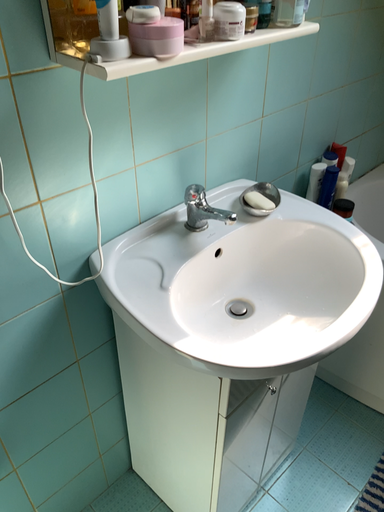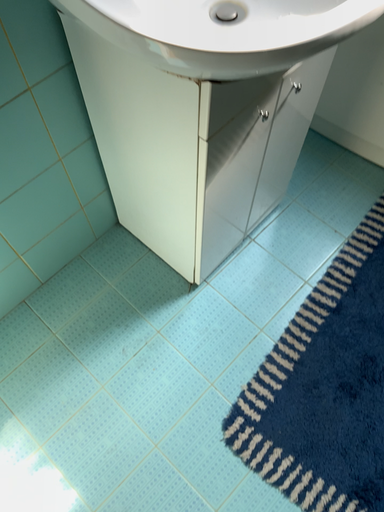
Question: Which way did the camera rotate in the video?

Choices:
 (A) rotated upward
 (B) rotated downward

Answer: (B)